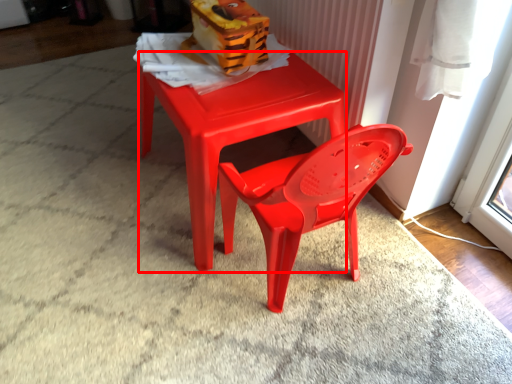
Question: Where is table (annotated by the red box) located in relation to toy in the image?

Choices:
 (A) right
 (B) left

Answer: (A)